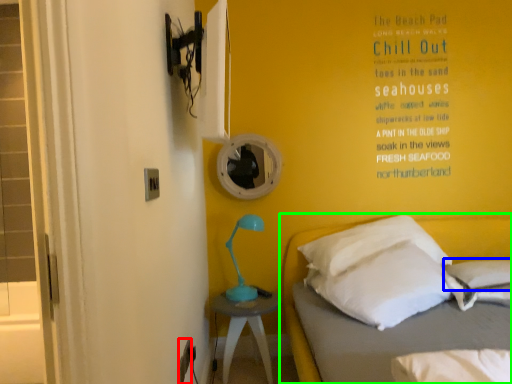
Question: Based on their relative distances, which object is farther from electric outlet (highlighted by a red box)? Choose from pillow (highlighted by a blue box) and bed (highlighted by a green box).

Choices:
 (A) pillow
 (B) bed

Answer: (A)